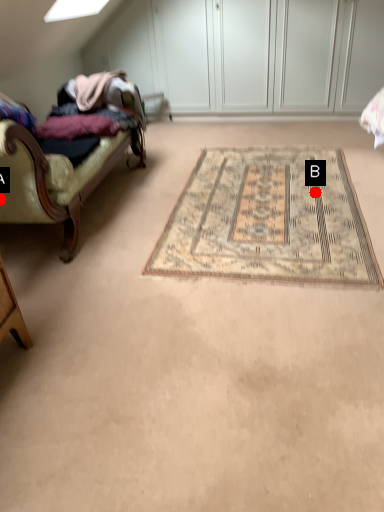
Question: Two points are circled on the image, labeled by A and B beside each circle. Which point is closer to the camera taking this photo?

Choices:
 (A) A is closer
 (B) B is closer

Answer: (A)